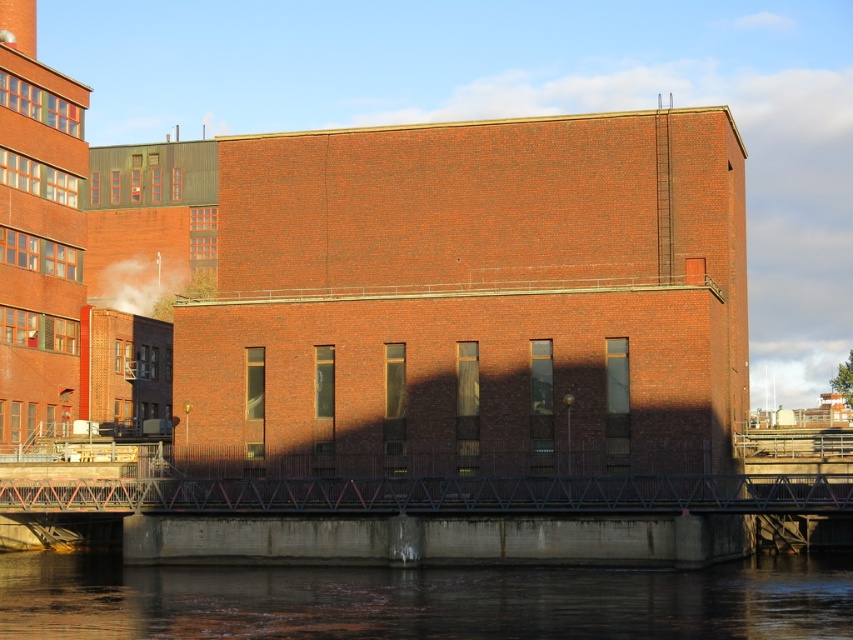
What do you see at coordinates (392, 310) in the screenshot?
I see `red brick building at center` at bounding box center [392, 310].

Which of these two, red brick building at center or dark concrete water at lower center, stands shorter?

With less height is dark concrete water at lower center.

Identify the location of red brick building at center. (392, 310).

Can you confirm if red brick building at center is positioned below white smoke at upper left?

Incorrect, red brick building at center is not positioned below white smoke at upper left.

You are a GUI agent. You are given a task and a screenshot of the screen. Output one action in this format:
    pyautogui.click(x=<x>, y=<y>)
    Task: Click on the red brick building at center
    
    Given the screenshot: What is the action you would take?
    [x=392, y=310]

Which is behind, point (329, 356) or point (132, 300)?

The point (132, 300) is more distant.

The image size is (853, 640). What are the coordinates of `red brick building at center` in the screenshot? It's located at click(x=392, y=310).

Does dark concrete water at lower center have a smaller size compared to white smoke at upper left?

Actually, dark concrete water at lower center might be larger than white smoke at upper left.

Does dark concrete water at lower center have a greater height compared to white smoke at upper left?

In fact, dark concrete water at lower center may be shorter than white smoke at upper left.

Describe the element at coordinates (422, 600) in the screenshot. The height and width of the screenshot is (640, 853). I see `dark concrete water at lower center` at that location.

Locate an element on the screen. dark concrete water at lower center is located at coordinates (422, 600).